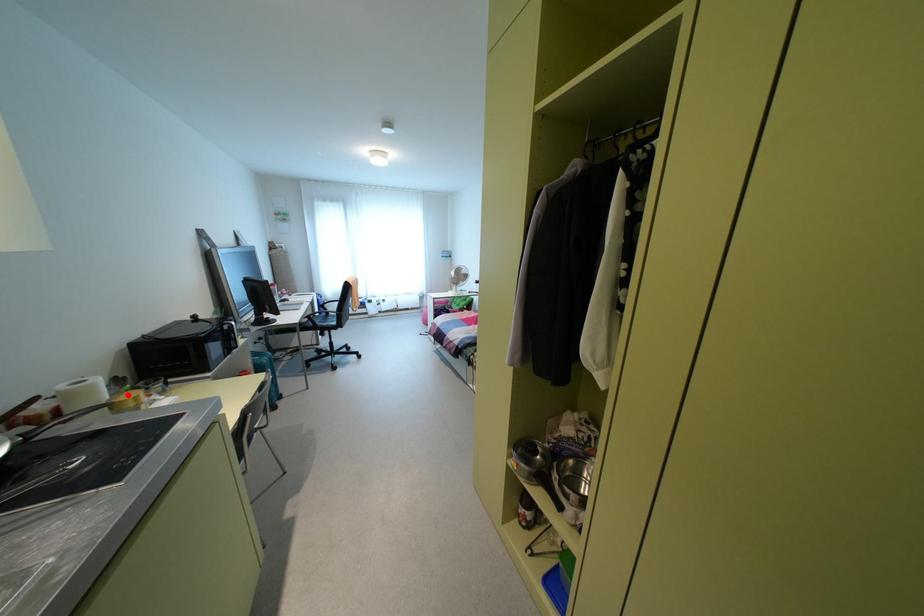
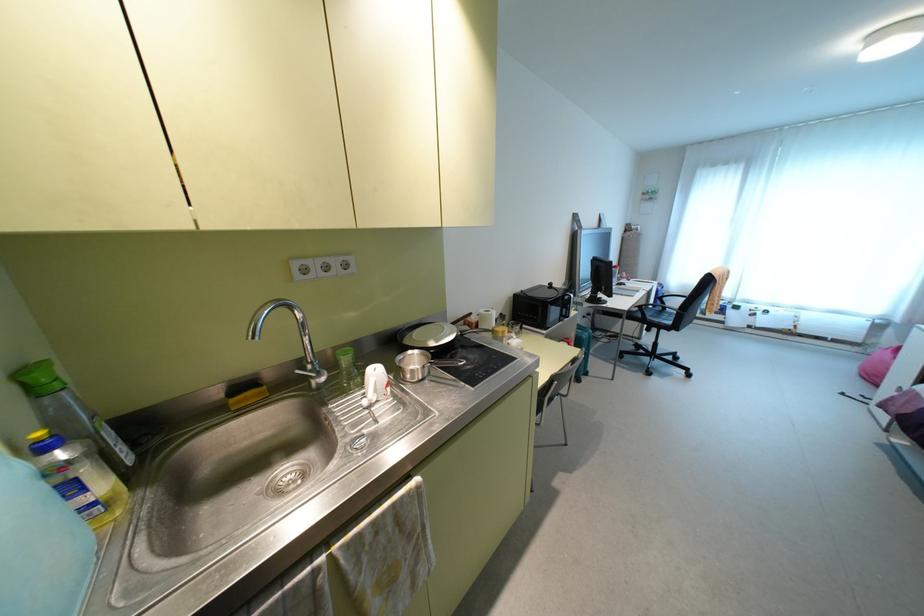
The point at the highlighted location is marked in the first image. Where is the corresponding point in the second image?

(500, 328)